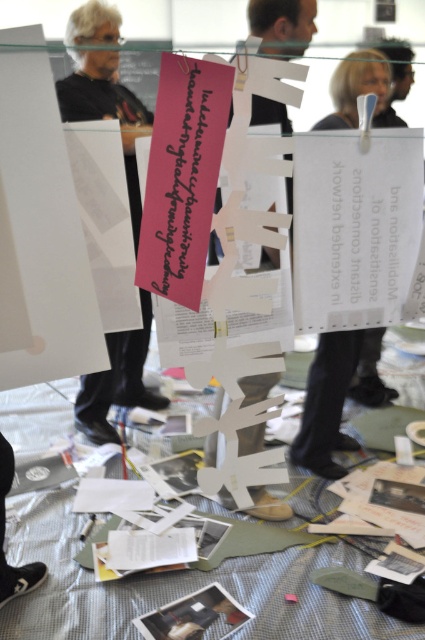
Question: Does black matte shirt at center appear under white paper at center?

Choices:
 (A) yes
 (B) no

Answer: (B)

Question: Can you confirm if white paper at upper center is wider than white paper at center?

Choices:
 (A) yes
 (B) no

Answer: (B)

Question: Which point is closer to the camera taking this photo?

Choices:
 (A) (306, 444)
 (B) (278, 1)

Answer: (B)

Question: Estimate the real-world distances between objects in this image. Which object is closer to the white paper at center?

Choices:
 (A) white paper at upper center
 (B) black matte shirt at center

Answer: (A)

Question: Which object is the farthest from the black matte shirt at center?

Choices:
 (A) white paper at center
 (B) white paper at upper center

Answer: (B)

Question: Does white paper at upper center appear on the left side of white paper at center?

Choices:
 (A) no
 (B) yes

Answer: (A)